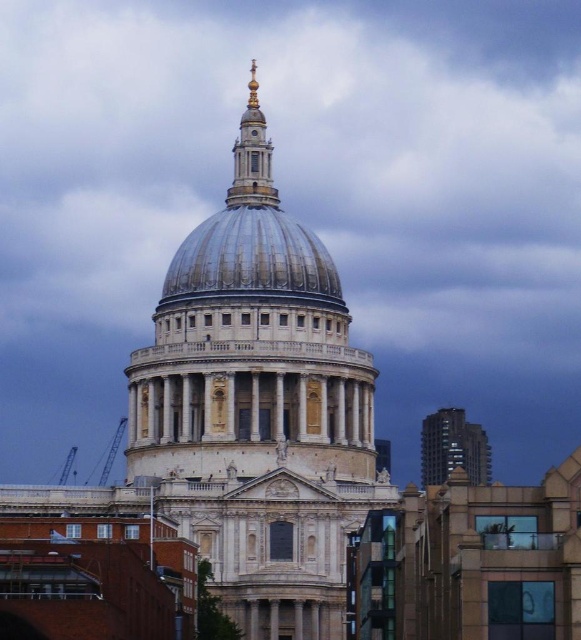
Question: Estimate the real-world distances between objects in this image. Which object is farther from the gold polished metal spire at upper center?

Choices:
 (A) shiny metallic dome at center
 (B) glassy reflective skyscraper at right
 (C) white marble dome at center

Answer: (B)

Question: Which point is closer to the camera taking this photo?

Choices:
 (A) 249,173
 (B) 157,419
 (C) 422,465

Answer: (B)

Question: Is white marble dome at center bigger than glassy reflective skyscraper at right?

Choices:
 (A) no
 (B) yes

Answer: (B)

Question: Can you confirm if shiny metallic dome at center is smaller than glassy reflective skyscraper at right?

Choices:
 (A) yes
 (B) no

Answer: (A)

Question: Considering the real-world distances, which object is closest to the gold polished metal spire at upper center?

Choices:
 (A) glassy reflective skyscraper at right
 (B) shiny metallic dome at center

Answer: (B)

Question: Is glassy reflective skyscraper at right to the right of gold polished metal spire at upper center from the viewer's perspective?

Choices:
 (A) no
 (B) yes

Answer: (B)